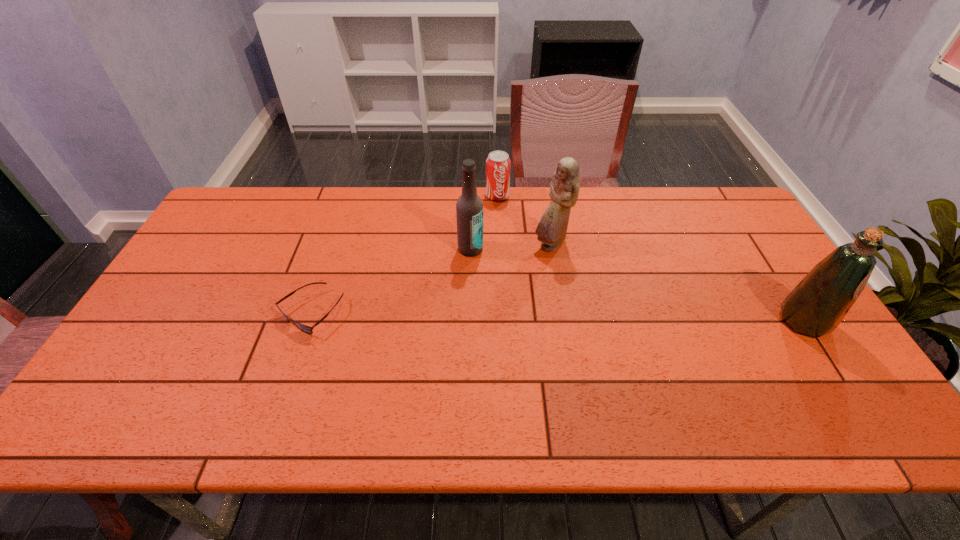
Where is `free space that satisfies the following two spatial constraints: 1. at the front of the sunglasses showing the lenses; 2. on the front-facing side of the olive oil`? Image resolution: width=960 pixels, height=540 pixels. free space that satisfies the following two spatial constraints: 1. at the front of the sunglasses showing the lenses; 2. on the front-facing side of the olive oil is located at coordinates (308, 321).

You are a GUI agent. You are given a task and a screenshot of the screen. Output one action in this format:
    pyautogui.click(x=<x>, y=<y>)
    Task: Click on the free spot that satisfies the following two spatial constraints: 1. at the front of the rightmost object showing the lenses; 2. on the front-facing side of the leftmost object
    
    Given the screenshot: What is the action you would take?
    [308, 321]

Where is `blank space that satisfies the following two spatial constraints: 1. at the front of the shortest object showing the lenses; 2. on the front-facing side of the olive oil`? The width and height of the screenshot is (960, 540). blank space that satisfies the following two spatial constraints: 1. at the front of the shortest object showing the lenses; 2. on the front-facing side of the olive oil is located at coordinates (308, 321).

Where is `free space that satisfies the following two spatial constraints: 1. on the front side of the fourth object from right to left; 2. on the front-facing side of the olive oil`? This screenshot has width=960, height=540. free space that satisfies the following two spatial constraints: 1. on the front side of the fourth object from right to left; 2. on the front-facing side of the olive oil is located at coordinates click(468, 321).